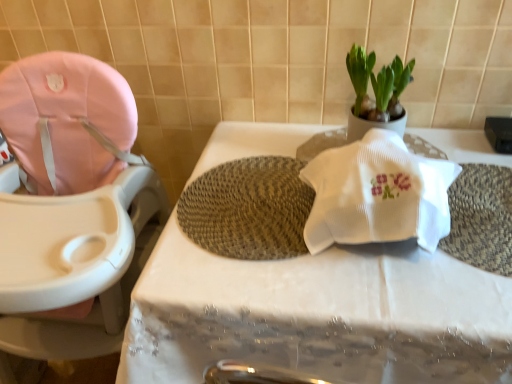
Measure the distance between point (356, 66) and camera.

Point (356, 66) and camera are 3.35 feet apart.

Describe the element at coordinates (376, 93) in the screenshot. This screenshot has width=512, height=384. I see `white matte pot at upper right` at that location.

In order to face woven beige bath mat at center, should I rotate leftwards or rightwards?

You should look right and rotate roughly 0.516 degrees.

Where is `white matte pot at upper right`? white matte pot at upper right is located at coordinates (376, 93).

Between white fabric table at center and pink fabric baby carriage at left, which one is positioned behind?

white fabric table at center is further away from the camera.

Who is shorter, white fabric table at center or pink fabric baby carriage at left?

white fabric table at center is shorter.

Which of these two, white fabric table at center or pink fabric baby carriage at left, is bigger?

white fabric table at center is bigger.

Locate an element on the screen. This screenshot has width=512, height=384. baby carriage in front of the white fabric table at center is located at coordinates (69, 204).

From the image's perspective, is white matte pot at upper right beneath woven beige bath mat at center?

No.

In the scene shown: Considering the sizes of objects white matte pot at upper right and woven beige bath mat at center in the image provided, who is shorter, white matte pot at upper right or woven beige bath mat at center?

woven beige bath mat at center is shorter.

Is pink fabric baby carriage at left further to the viewer compared to white matte pot at upper right?

That is False.

Consider the image. Considering the relative sizes of pink fabric baby carriage at left and white matte pot at upper right in the image provided, is pink fabric baby carriage at left taller than white matte pot at upper right?

Correct, pink fabric baby carriage at left is much taller as white matte pot at upper right.

Between point (120, 324) and point (347, 65), which one is positioned in front?

The point (120, 324) is closer to the camera.

From the image's perspective, which is below, pink fabric baby carriage at left or white matte pot at upper right?

pink fabric baby carriage at left, from the image's perspective.

Which is in front, point (139, 156) or point (440, 367)?

The point (440, 367) is closer.

Can white fabric table at center be found inside pink fabric baby carriage at left?

Definitely not — white fabric table at center is not inside pink fabric baby carriage at left.

From a real-world perspective, which is physically above, pink fabric baby carriage at left or white fabric table at center?

pink fabric baby carriage at left, from a real-world perspective.

How different are the orientations of woven beige bath mat at center and pink fabric baby carriage at left in degrees?

0.0502 degrees.

Does woven beige bath mat at center have a larger size compared to pink fabric baby carriage at left?

Actually, woven beige bath mat at center might be smaller than pink fabric baby carriage at left.

Is woven beige bath mat at center surrounding pink fabric baby carriage at left?

No, pink fabric baby carriage at left is not inside woven beige bath mat at center.

Would you consider woven beige bath mat at center to be distant from pink fabric baby carriage at left?

That's not correct — woven beige bath mat at center is a little close to pink fabric baby carriage at left.

Looking at this image, is pink fabric baby carriage at left not near woven beige bath mat at center?

No, pink fabric baby carriage at left is not far from woven beige bath mat at center.

Which is in front, point (50, 282) or point (275, 181)?

The point (50, 282) is closer.

Considering the sizes of objects pink fabric baby carriage at left and woven beige bath mat at center in the image provided, who is bigger, pink fabric baby carriage at left or woven beige bath mat at center?

pink fabric baby carriage at left is bigger.

Considering the positions of objects pink fabric baby carriage at left and woven beige bath mat at center in the image provided, who is behind, pink fabric baby carriage at left or woven beige bath mat at center?

woven beige bath mat at center is behind.

Which is nearer, (389,107) or (53,324)?

Point (389,107) is closer to the camera than point (53,324).

Is pink fabric baby carriage at left at the back of white matte pot at upper right?

No, white matte pot at upper right is not facing away from pink fabric baby carriage at left.

Is white matte pot at upper right shorter than pink fabric baby carriage at left?

Yes.

Which object is positioned more to the right, white matte pot at upper right or pink fabric baby carriage at left?

From the viewer's perspective, white matte pot at upper right appears more on the right side.

Find the location of a particular element. baby carriage that is in front of the white fabric table at center is located at coordinates (69, 204).

The height and width of the screenshot is (384, 512). I want to click on houseplant above the woven beige bath mat at center (from a real-world perspective), so click(x=376, y=93).

Based on their spatial positions, is pink fabric baby carriage at left or white fabric table at center closer to woven beige bath mat at center?

The object closer to woven beige bath mat at center is white fabric table at center.

Based on the photo, looking at the image, which one is located closer to white matte pot at upper right, pink fabric baby carriage at left or white fabric table at center?

white fabric table at center is closer to white matte pot at upper right.

When comparing their distances from white fabric table at center, does woven beige bath mat at center or white matte pot at upper right seem further?

white matte pot at upper right is further to white fabric table at center.

Looking at the image, which one is located further to white matte pot at upper right, woven beige bath mat at center or white fabric table at center?

white fabric table at center is further to white matte pot at upper right.

Based on their spatial positions, is white fabric table at center or woven beige bath mat at center closer to white matte pot at upper right?

woven beige bath mat at center is positioned closer to the anchor white matte pot at upper right.

Based on their spatial positions, is woven beige bath mat at center or pink fabric baby carriage at left further from white fabric table at center?

pink fabric baby carriage at left is positioned further to the anchor white fabric table at center.

Considering their positions, is white fabric table at center positioned closer to woven beige bath mat at center than white matte pot at upper right?

white fabric table at center is closer to woven beige bath mat at center.

Estimate the real-world distances between objects in this image. Which object is further from pink fabric baby carriage at left, white matte pot at upper right or woven beige bath mat at center?

Based on the image, white matte pot at upper right appears to be further to pink fabric baby carriage at left.

The image size is (512, 384). I want to click on bath mat between white matte pot at upper right and white fabric table at center vertically, so click(248, 209).

Where is `bath mat between pink fabric baby carriage at left and white matte pot at upper right in the horizontal direction`? The width and height of the screenshot is (512, 384). bath mat between pink fabric baby carriage at left and white matte pot at upper right in the horizontal direction is located at coordinates (248, 209).

Where is `houseplant located between pink fabric baby carriage at left and white fabric table at center in the left-right direction`? houseplant located between pink fabric baby carriage at left and white fabric table at center in the left-right direction is located at coordinates (376, 93).

This screenshot has width=512, height=384. I want to click on bath mat located between pink fabric baby carriage at left and white fabric table at center in the left-right direction, so click(x=248, y=209).